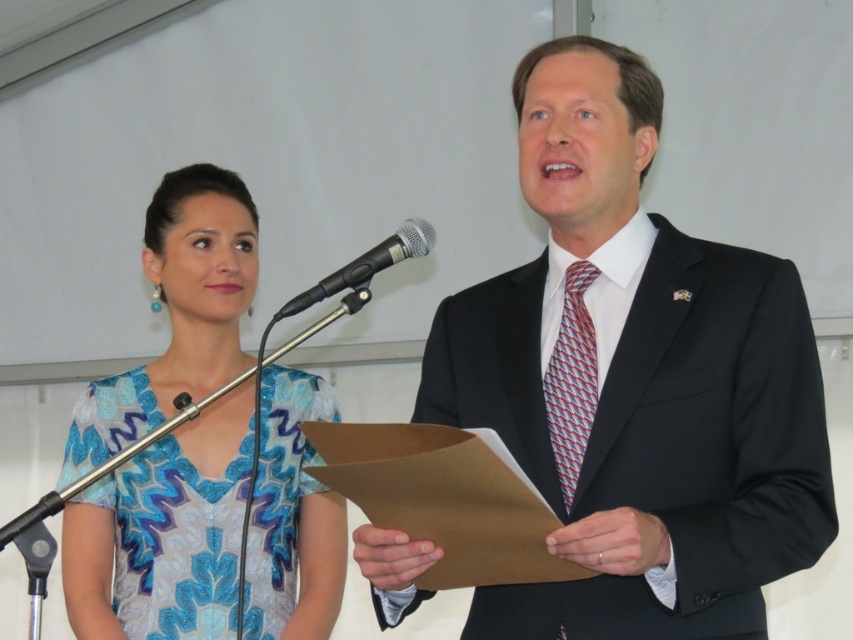
You are an event planner setting up a photo shoot. You need to position a camera so that both the shiny blue dress at center and the black metallic microphone at center are visible in the frame. Based on their positions, which side of the microphone should you place the dress to ensure they are both in the shot?

The shiny blue dress at center is to the left of the black metallic microphone at center, so placing the dress to the left side of the microphone in the frame will ensure both are visible.